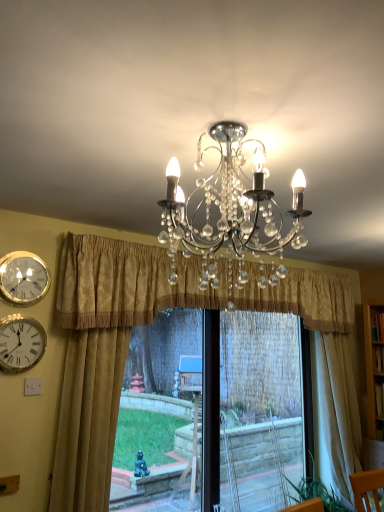
What do you see at coordinates (260, 410) in the screenshot?
I see `black plastic window frame at center` at bounding box center [260, 410].

Locate an element on the screen. The height and width of the screenshot is (512, 384). black plastic window frame at center is located at coordinates (260, 410).

Identify the location of beige fabric curtain at right, positioned as the third curtain in left-to-right order. (336, 412).

You are a GUI agent. You are given a task and a screenshot of the screen. Output one action in this format:
    pyautogui.click(x=<x>, y=<y>)
    Task: Click on the gold textured curtain at left, the third curtain when ordered from right to left
    
    Given the screenshot: What is the action you would take?
    pyautogui.click(x=88, y=419)

Identify the location of curtain that appears behind the black plastic window frame at center. The height and width of the screenshot is (512, 384). (336, 412).

Between black plastic window frame at center and beige fabric curtain at right, the first curtain when ordered from right to left, which one has larger size?

black plastic window frame at center.

Is there a large distance between black plastic window frame at center and beige fabric curtain at right, the first curtain when ordered from right to left?

Yes, black plastic window frame at center and beige fabric curtain at right, the first curtain when ordered from right to left, are quite far apart.

Is black plastic window frame at center to the left of beige fabric curtain at right, the first curtain when ordered from right to left, from the viewer's perspective?

Indeed, black plastic window frame at center is positioned on the left side of beige fabric curtain at right, the first curtain when ordered from right to left.

Are black plastic window frame at center and gold textured curtain at left, the third curtain when ordered from right to left, beside each other?

No, black plastic window frame at center is not touching gold textured curtain at left, the third curtain when ordered from right to left.

In the image, is black plastic window frame at center positioned in front of or behind gold textured curtain at left, the 1th curtain when ordered from left to right?

Clearly, black plastic window frame at center is behind gold textured curtain at left, the 1th curtain when ordered from left to right.

Consider the image. Could you measure the distance between black plastic window frame at center and gold textured curtain at left, the 1th curtain when ordered from left to right?

black plastic window frame at center is 2.88 meters from gold textured curtain at left, the 1th curtain when ordered from left to right.

Based on the photo, from a real-world perspective, is black plastic window frame at center positioned over gold textured curtain at left, the 1th curtain when ordered from left to right, based on gravity?

No, from a real-world perspective, black plastic window frame at center is not above gold textured curtain at left, the 1th curtain when ordered from left to right.

Would you say beige fabric curtain at right, the first curtain when ordered from right to left, is outside gold metallic wall clock at upper left, which is counted as the first wall clock, starting from the top?

Indeed, beige fabric curtain at right, the first curtain when ordered from right to left, is completely outside gold metallic wall clock at upper left, which is counted as the first wall clock, starting from the top.

This screenshot has height=512, width=384. There is a beige fabric curtain at right, positioned as the third curtain in left-to-right order. What are the coordinates of `the 2nd wall clock above it (from a real-world perspective)` in the screenshot? It's located at (23, 278).

In the scene shown: Does beige fabric curtain at right, positioned as the third curtain in left-to-right order, have a greater width compared to gold metallic wall clock at upper left, the 2th wall clock when ordered from bottom to top?

Yes, beige fabric curtain at right, positioned as the third curtain in left-to-right order, is wider than gold metallic wall clock at upper left, the 2th wall clock when ordered from bottom to top.

Is beige fabric curtain at right, positioned as the third curtain in left-to-right order, facing away from gold metallic wall clock at upper left, the 2th wall clock when ordered from bottom to top?

beige fabric curtain at right, positioned as the third curtain in left-to-right order, does not have its back to gold metallic wall clock at upper left, the 2th wall clock when ordered from bottom to top.

Can you confirm if white glossy wall clock at left, which is counted as the 2th wall clock, starting from the top, is shorter than gold textured curtain at center, which is the 2th curtain from left to right?

Indeed, white glossy wall clock at left, which is counted as the 2th wall clock, starting from the top, has a lesser height compared to gold textured curtain at center, which is the 2th curtain from left to right.

Which is more to the right, white glossy wall clock at left, the first wall clock positioned from the bottom, or gold textured curtain at center, which ranks as the 2th curtain in right-to-left order?

Positioned to the right is gold textured curtain at center, which ranks as the 2th curtain in right-to-left order.

From a real-world perspective, is white glossy wall clock at left, the first wall clock positioned from the bottom, physically below gold textured curtain at center, which ranks as the 2th curtain in right-to-left order?

Yes, from a real-world perspective, white glossy wall clock at left, the first wall clock positioned from the bottom, is below gold textured curtain at center, which ranks as the 2th curtain in right-to-left order.

Does white glossy wall clock at left, which is counted as the 2th wall clock, starting from the top, have a larger size compared to gold textured curtain at center, which ranks as the 2th curtain in right-to-left order?

No.

Considering the positions of point (26, 356) and point (94, 408), is point (26, 356) closer or farther from the camera than point (94, 408)?

Point (26, 356).

At what (x,y) coordinates should I click in order to perform the action: click on curtain that is the 1st object directly below the white glossy wall clock at left, the first wall clock positioned from the bottom (from a real-world perspective). Please return your answer as a coordinate pair (x, y). The height and width of the screenshot is (512, 384). Looking at the image, I should click on (88, 419).

Consider the image. Is white glossy wall clock at left, the first wall clock positioned from the bottom, bigger than gold textured curtain at left, the third curtain when ordered from right to left?

No.

From the image's perspective, which one is positioned lower, gold textured curtain at center, which is the 2th curtain from left to right, or black plastic window frame at center?

black plastic window frame at center appears lower in the image.

Considering the positions of objects gold textured curtain at center, which is the 2th curtain from left to right, and black plastic window frame at center in the image provided, who is in front, gold textured curtain at center, which is the 2th curtain from left to right, or black plastic window frame at center?

Positioned in front is gold textured curtain at center, which is the 2th curtain from left to right.

Would you say gold textured curtain at center, which ranks as the 2th curtain in right-to-left order, is outside black plastic window frame at center?

Absolutely, gold textured curtain at center, which ranks as the 2th curtain in right-to-left order, is external to black plastic window frame at center.

Are gold textured curtain at center, which ranks as the 2th curtain in right-to-left order, and black plastic window frame at center located far from each other?

That's right, there is a large distance between gold textured curtain at center, which ranks as the 2th curtain in right-to-left order, and black plastic window frame at center.

Would you say gold textured curtain at center, which is the 2th curtain from left to right, is part of beige fabric curtain at right, the first curtain when ordered from right to left,'s contents?

No, gold textured curtain at center, which is the 2th curtain from left to right, is not surrounded by beige fabric curtain at right, the first curtain when ordered from right to left.

Measure the distance from beige fabric curtain at right, the first curtain when ordered from right to left, to gold textured curtain at center, which ranks as the 2th curtain in right-to-left order.

A distance of 77.42 centimeters exists between beige fabric curtain at right, the first curtain when ordered from right to left, and gold textured curtain at center, which ranks as the 2th curtain in right-to-left order.

Is beige fabric curtain at right, the first curtain when ordered from right to left, beside gold textured curtain at center, which is the 2th curtain from left to right?

No, beige fabric curtain at right, the first curtain when ordered from right to left, is not in contact with gold textured curtain at center, which is the 2th curtain from left to right.

How many degrees apart are the facing directions of beige fabric curtain at right, positioned as the third curtain in left-to-right order, and gold textured curtain at center, which is the 2th curtain from left to right?

There is a 5.37-degree angle between the facing directions of beige fabric curtain at right, positioned as the third curtain in left-to-right order, and gold textured curtain at center, which is the 2th curtain from left to right.

Identify the location of window frame in front of the beige fabric curtain at right, positioned as the third curtain in left-to-right order. (260, 410).

The width and height of the screenshot is (384, 512). I want to click on window frame that appears below the gold textured curtain at left, the 1th curtain when ordered from left to right (from a real-world perspective), so click(x=260, y=410).

Which object lies nearer to the anchor point white glossy wall clock at left, which is counted as the 2th wall clock, starting from the top, black plastic window frame at center or gold metallic wall clock at upper left, the 2th wall clock when ordered from bottom to top?

gold metallic wall clock at upper left, the 2th wall clock when ordered from bottom to top, is positioned closer to the anchor white glossy wall clock at left, which is counted as the 2th wall clock, starting from the top.

From the image, which object appears to be nearer to gold metallic wall clock at upper left, the 2th wall clock when ordered from bottom to top, white glossy wall clock at left, which is counted as the 2th wall clock, starting from the top, or gold textured curtain at left, the 1th curtain when ordered from left to right?

white glossy wall clock at left, which is counted as the 2th wall clock, starting from the top, is positioned closer to the anchor gold metallic wall clock at upper left, the 2th wall clock when ordered from bottom to top.

Considering their positions, is black plastic window frame at center positioned closer to gold metallic wall clock at upper left, which is counted as the first wall clock, starting from the top, than beige fabric curtain at right, positioned as the third curtain in left-to-right order?

The object closer to gold metallic wall clock at upper left, which is counted as the first wall clock, starting from the top, is beige fabric curtain at right, positioned as the third curtain in left-to-right order.

From the image, which object appears to be farther from white glossy wall clock at left, which is counted as the 2th wall clock, starting from the top, gold textured curtain at center, which ranks as the 2th curtain in right-to-left order, or gold textured curtain at left, the third curtain when ordered from right to left?

gold textured curtain at center, which ranks as the 2th curtain in right-to-left order, lies further to white glossy wall clock at left, which is counted as the 2th wall clock, starting from the top, than the other object.

Considering their positions, is gold textured curtain at left, the 1th curtain when ordered from left to right, positioned further to gold metallic wall clock at upper left, the 2th wall clock when ordered from bottom to top, than black plastic window frame at center?

Among the two, black plastic window frame at center is located further to gold metallic wall clock at upper left, the 2th wall clock when ordered from bottom to top.

Considering their positions, is beige fabric curtain at right, the first curtain when ordered from right to left, positioned further to gold textured curtain at center, which is the 2th curtain from left to right, than white glossy wall clock at left, the first wall clock positioned from the bottom?

white glossy wall clock at left, the first wall clock positioned from the bottom, is further to gold textured curtain at center, which is the 2th curtain from left to right.

In the scene shown: Looking at the image, which one is located closer to gold textured curtain at center, which is the 2th curtain from left to right, gold metallic wall clock at upper left, the 2th wall clock when ordered from bottom to top, or black plastic window frame at center?

Based on the image, gold metallic wall clock at upper left, the 2th wall clock when ordered from bottom to top, appears to be nearer to gold textured curtain at center, which is the 2th curtain from left to right.

When comparing their distances from black plastic window frame at center, does white glossy wall clock at left, the first wall clock positioned from the bottom, or gold textured curtain at left, the third curtain when ordered from right to left, seem closer?

Among the two, gold textured curtain at left, the third curtain when ordered from right to left, is located nearer to black plastic window frame at center.

Find the location of a particular element. This screenshot has width=384, height=512. curtain situated between gold textured curtain at left, the 1th curtain when ordered from left to right, and beige fabric curtain at right, positioned as the third curtain in left-to-right order, from left to right is located at coordinates pyautogui.click(x=126, y=284).

Find the location of a particular element. wall clock between white glossy wall clock at left, which is counted as the 2th wall clock, starting from the top, and beige fabric curtain at right, positioned as the third curtain in left-to-right order is located at coordinates (23, 278).

Identify the location of window frame between gold metallic wall clock at upper left, the 2th wall clock when ordered from bottom to top, and beige fabric curtain at right, the first curtain when ordered from right to left, from left to right. Image resolution: width=384 pixels, height=512 pixels. (260, 410).

Image resolution: width=384 pixels, height=512 pixels. I want to click on curtain between white glossy wall clock at left, which is counted as the 2th wall clock, starting from the top, and gold textured curtain at center, which is the 2th curtain from left to right, from left to right, so click(88, 419).